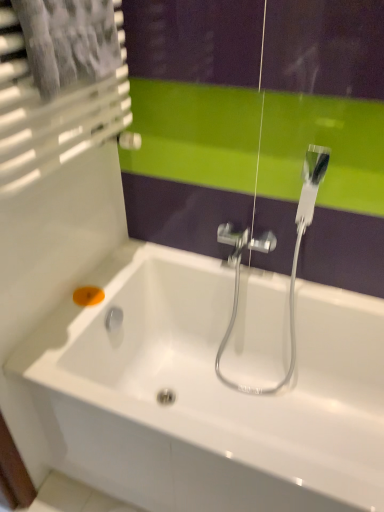
What do you see at coordinates (88, 296) in the screenshot?
I see `orange matte soap at lower left` at bounding box center [88, 296].

Find the location of a particular element. The width and height of the screenshot is (384, 512). orange matte soap at lower left is located at coordinates (88, 296).

This screenshot has width=384, height=512. Find the location of `white glossy bathtub at center`. white glossy bathtub at center is located at coordinates (207, 393).

Describe the element at coordinates (207, 393) in the screenshot. I see `white glossy bathtub at center` at that location.

Identify the location of orange matte soap at lower left. Image resolution: width=384 pixels, height=512 pixels. (88, 296).

Is white glossy bathtub at center to the left or to the right of orange matte soap at lower left in the image?

In the image, white glossy bathtub at center appears on the right side of orange matte soap at lower left.

Is white glossy bathtub at center closer to the viewer compared to orange matte soap at lower left?

Yes, it is in front of orange matte soap at lower left.

Considering the points (92, 390) and (89, 303), which point is behind, point (92, 390) or point (89, 303)?

The point (89, 303) is more distant.

From the image's perspective, is white glossy bathtub at center on top of orange matte soap at lower left?

Actually, white glossy bathtub at center appears below orange matte soap at lower left in the image.

From the picture: From a real-world perspective, is white glossy bathtub at center physically located above or below orange matte soap at lower left?

white glossy bathtub at center is below orange matte soap at lower left.

Does white glossy bathtub at center have a lesser width compared to orange matte soap at lower left?

No, white glossy bathtub at center is not thinner than orange matte soap at lower left.

Looking at this image, from their relative heights in the image, would you say white glossy bathtub at center is taller or shorter than orange matte soap at lower left?

Clearly, white glossy bathtub at center is taller compared to orange matte soap at lower left.

Is white glossy bathtub at center bigger than orange matte soap at lower left?

Correct, white glossy bathtub at center is larger in size than orange matte soap at lower left.

Would you say white glossy bathtub at center is outside orange matte soap at lower left?

white glossy bathtub at center is positioned outside orange matte soap at lower left.

Is there a large distance between white glossy bathtub at center and orange matte soap at lower left?

white glossy bathtub at center is actually quite close to orange matte soap at lower left.

Is orange matte soap at lower left at the back of white glossy bathtub at center?

white glossy bathtub at center does not have its back to orange matte soap at lower left.

Can you tell me how much white glossy bathtub at center and orange matte soap at lower left differ in facing direction?

90 degrees separate the facing orientations of white glossy bathtub at center and orange matte soap at lower left.

You are a GUI agent. You are given a task and a screenshot of the screen. Output one action in this format:
    pyautogui.click(x=<x>, y=<y>)
    Task: Click on the bathtub that is in front of the orange matte soap at lower left
    The image size is (384, 512).
    Given the screenshot: What is the action you would take?
    pyautogui.click(x=207, y=393)

Can you confirm if orange matte soap at lower left is positioned to the right of white glossy bathtub at center?

Incorrect, orange matte soap at lower left is not on the right side of white glossy bathtub at center.

Considering their positions, is orange matte soap at lower left located in front of or behind white glossy bathtub at center?

In the image, orange matte soap at lower left appears behind white glossy bathtub at center.

Does point (85, 301) come closer to viewer compared to point (275, 306)?

Yes, it is in front of point (275, 306).

From the image's perspective, who appears lower, orange matte soap at lower left or white glossy bathtub at center?

white glossy bathtub at center, from the image's perspective.

From a real-world perspective, is orange matte soap at lower left positioned above or below white glossy bathtub at center?

Clearly, from a real-world perspective, orange matte soap at lower left is above white glossy bathtub at center.

Is orange matte soap at lower left wider than white glossy bathtub at center?

No, orange matte soap at lower left is not wider than white glossy bathtub at center.

Is orange matte soap at lower left taller than white glossy bathtub at center?

No, orange matte soap at lower left is not taller than white glossy bathtub at center.

From the picture: Considering the sizes of objects orange matte soap at lower left and white glossy bathtub at center in the image provided, who is smaller, orange matte soap at lower left or white glossy bathtub at center?

Smaller between the two is orange matte soap at lower left.

Is orange matte soap at lower left surrounding white glossy bathtub at center?

Actually, white glossy bathtub at center is outside orange matte soap at lower left.

Is orange matte soap at lower left next to white glossy bathtub at center and touching it?

orange matte soap at lower left is not next to white glossy bathtub at center, and they're not touching.

Does orange matte soap at lower left turn towards white glossy bathtub at center?

Yes, orange matte soap at lower left is aimed at white glossy bathtub at center.

How many degrees apart are the facing directions of orange matte soap at lower left and white glossy bathtub at center?

The angle between the facing direction of orange matte soap at lower left and the facing direction of white glossy bathtub at center is 90 degrees.

The image size is (384, 512). Identify the location of soap lying behind the white glossy bathtub at center. (88, 296).

Identify the location of bathtub that is in front of the orange matte soap at lower left. The height and width of the screenshot is (512, 384). (207, 393).

The height and width of the screenshot is (512, 384). Find the location of `soap on the left of white glossy bathtub at center`. soap on the left of white glossy bathtub at center is located at coordinates (88, 296).